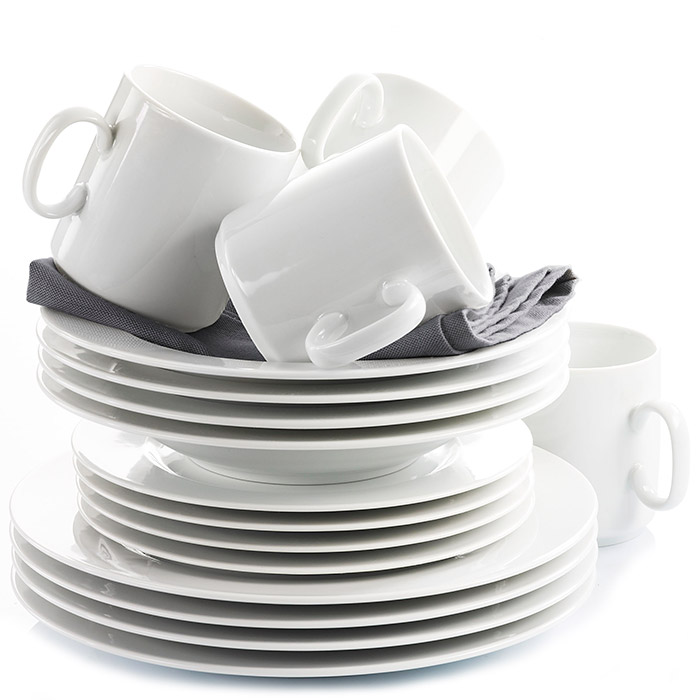
Where is `white mugs`? white mugs is located at coordinates click(x=315, y=294), click(x=435, y=130), click(x=200, y=190), click(x=605, y=405).